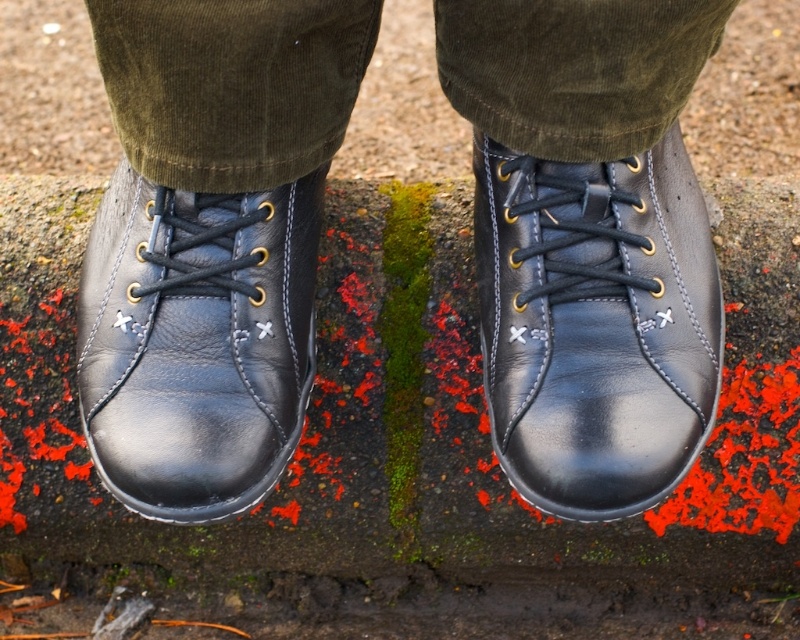
Consider the image. You are a fashion designer analyzing footwear in an image. You notice the black leather shoes at center and the shiny black leather boot at center. Which of these two items has a greater height measurement?

The black leather shoes at center is much taller as shiny black leather boot at center, so the black leather shoes at center has a greater height measurement.